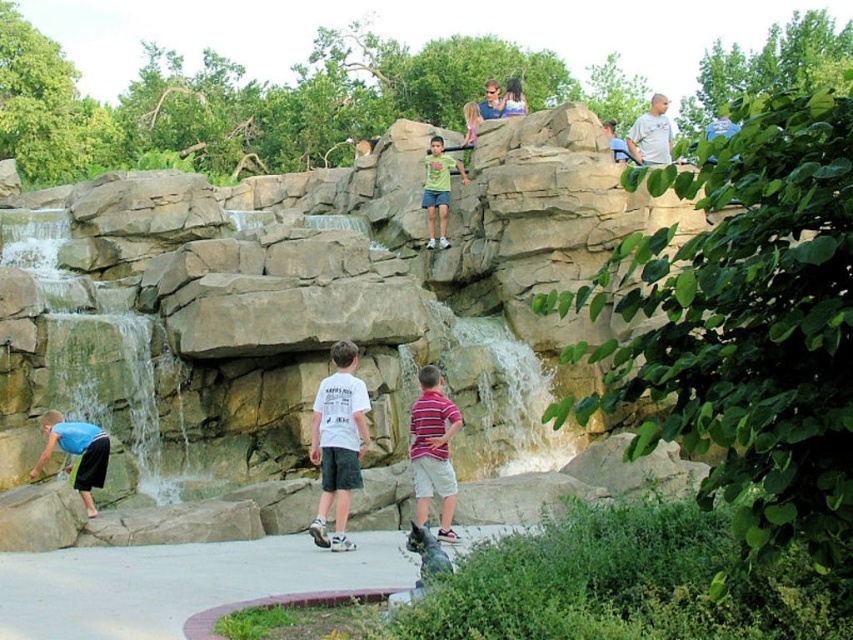
You are a photographer trying to capture a photo of the striped cotton shirt at center and the green matte shirt at upper center. Which of the two shirts should you focus on first if you want to capture them in the order they appear from left to right?

The striped cotton shirt at center should be focused on first because it is positioned to the left of the green matte shirt at upper center.

You are a photographer trying to capture a group photo of the white cotton shirt at center and the green matte shirt at upper center. Which child should you focus on first if you want to ensure they are in focus, considering their sizes?

The white cotton shirt at center is bigger than the green matte shirt at upper center, so you should focus on the white cotton shirt at center first to ensure proper focus.